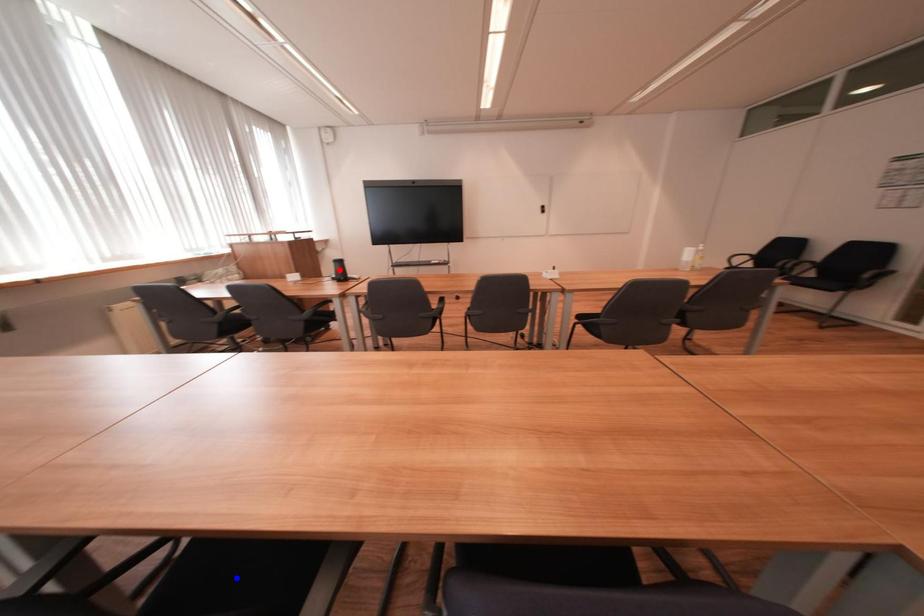
Question: Two points are marked on the image. Which point is closer to the camera?

Choices:
 (A) Blue point is closer.
 (B) Red point is closer.

Answer: (A)